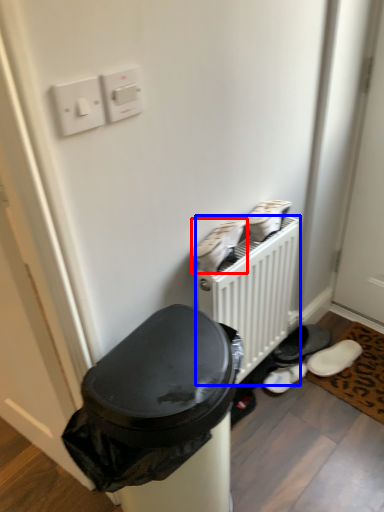
Question: Which object is closer to the camera taking this photo, footwear (highlighted by a red box) or radiator (highlighted by a blue box)?

Choices:
 (A) footwear
 (B) radiator

Answer: (A)